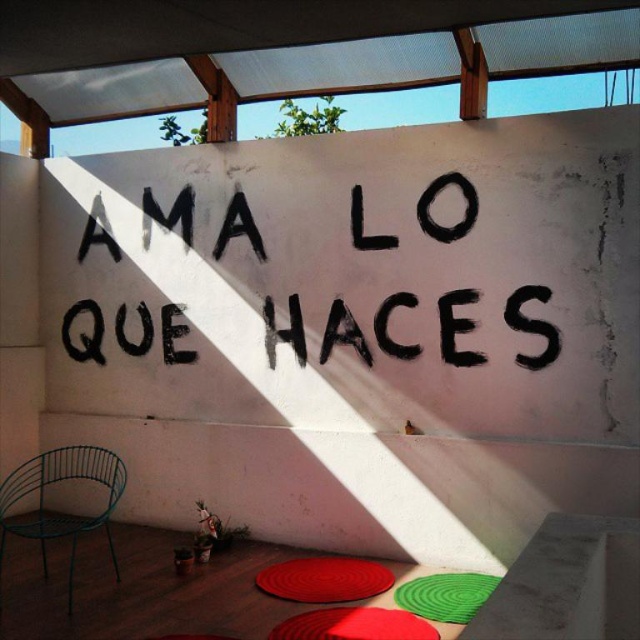
Question: Does black painted text at center appear on the right side of green wire chair at lower left?

Choices:
 (A) no
 (B) yes

Answer: (B)

Question: Considering the relative positions of rubberized red circular mat at lower center and red rubber mat at lower center in the image provided, where is rubberized red circular mat at lower center located with respect to red rubber mat at lower center?

Choices:
 (A) above
 (B) below

Answer: (A)

Question: Among these objects, which one is farthest from the camera?

Choices:
 (A) red rubber mat at lower center
 (B) green wire chair at lower left

Answer: (B)

Question: Is green wire chair at lower left bigger than green spiral mat at center?

Choices:
 (A) yes
 (B) no

Answer: (A)

Question: Which point appears farthest from the camera in this image?

Choices:
 (A) (417, 406)
 (B) (118, 337)

Answer: (B)

Question: Which object is closer to the camera taking this photo?

Choices:
 (A) black painted text at center
 (B) rubberized red circular mat at lower center

Answer: (B)